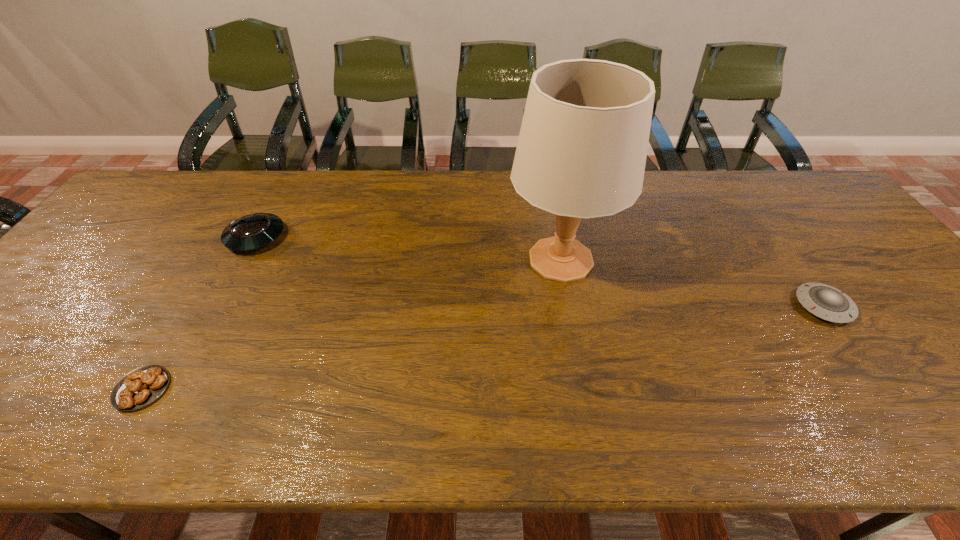
Locate an element on the screen. table lamp is located at coordinates (581, 153).

You are a GUI agent. You are given a task and a screenshot of the screen. Output one action in this format:
    pyautogui.click(x=<x>, y=<y>)
    Task: Click on the tallest object
    This screenshot has width=960, height=540.
    Given the screenshot: What is the action you would take?
    pyautogui.click(x=581, y=153)

Where is `the farther saucer`? the farther saucer is located at coordinates (254, 231).

Identify the location of the taller saucer. (254, 231).

This screenshot has height=540, width=960. What are the coordinates of `the right saucer` in the screenshot? It's located at (824, 301).

The height and width of the screenshot is (540, 960). In order to click on the nearer saucer in this screenshot , I will do `click(824, 301)`.

The height and width of the screenshot is (540, 960). I want to click on the nearest object, so click(140, 387).

Find the location of a particular element. This screenshot has width=960, height=540. the shortest object is located at coordinates (140, 387).

Identify the location of free space located 0.140m on the back of the tallest object. (549, 197).

Identify the location of free location located 0.240m on the front of the second tallest object. (208, 326).